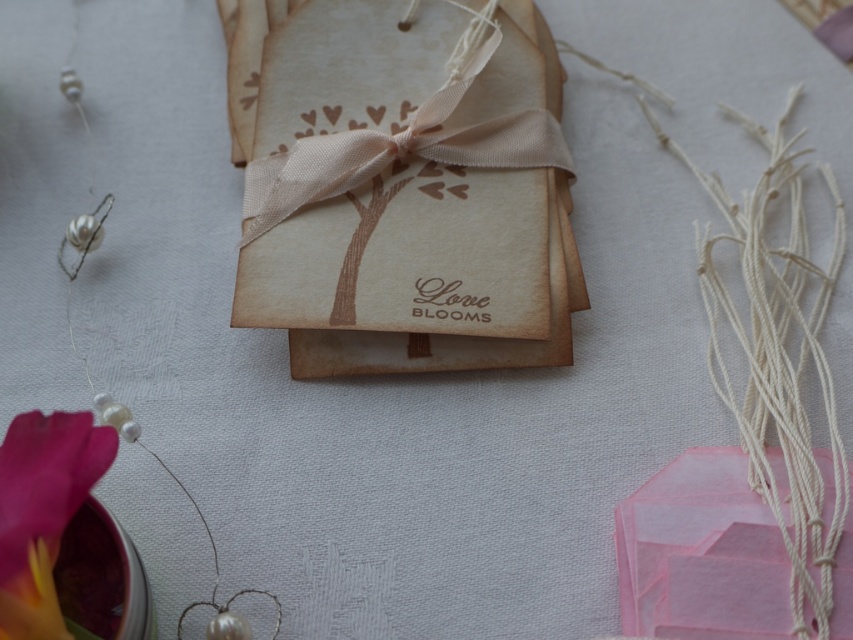
You are designing a greeting card and need to place the transparent pink box at center and the matte pink petal at lower left. According to the image, which object is positioned lower on the page?

The transparent pink box at center is positioned lower than the matte pink petal at lower left.

What is the position of the point at coordinates [701,554] in the image?

The point at coordinates [701,554] is located on the transparent pink box at center.

You are organizing a gift and need to place the matte brown paper bag at center and the transparent pink box at center in a specific order. According to the scene, which object is positioned to the left of the other?

The matte brown paper bag at center is to the left of transparent pink box at center.